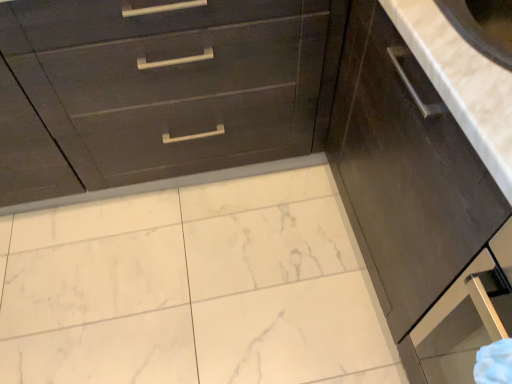
Question: Could you tell me if dark wood cabinet at right is turned towards dark wood drawer at upper left?

Choices:
 (A) yes
 (B) no

Answer: (B)

Question: Considering the relative sizes of dark wood cabinet at right and dark wood drawer at upper left in the image provided, is dark wood cabinet at right taller than dark wood drawer at upper left?

Choices:
 (A) no
 (B) yes

Answer: (A)

Question: Is dark wood cabinet at right further to the viewer compared to dark wood drawer at upper left?

Choices:
 (A) no
 (B) yes

Answer: (A)

Question: Is dark wood cabinet at right looking in the opposite direction of dark wood drawer at upper left?

Choices:
 (A) no
 (B) yes

Answer: (A)

Question: Would you say dark wood cabinet at right is a long distance from dark wood drawer at upper left?

Choices:
 (A) no
 (B) yes

Answer: (A)

Question: Is the surface of dark wood cabinet at right in direct contact with dark wood drawer at upper left?

Choices:
 (A) no
 (B) yes

Answer: (A)

Question: Can dark wood cabinet at right be found inside dark wood drawer at upper left?

Choices:
 (A) no
 (B) yes

Answer: (A)

Question: Is dark wood drawer at upper left aimed at dark wood cabinet at right?

Choices:
 (A) no
 (B) yes

Answer: (A)

Question: Is dark wood drawer at upper left not close to dark wood cabinet at right?

Choices:
 (A) no
 (B) yes

Answer: (A)

Question: Is dark wood drawer at upper left closer to camera compared to dark wood cabinet at right?

Choices:
 (A) no
 (B) yes

Answer: (A)

Question: Is dark wood drawer at upper left smaller than dark wood cabinet at right?

Choices:
 (A) no
 (B) yes

Answer: (A)

Question: Is dark wood drawer at upper left positioned beyond the bounds of dark wood cabinet at right?

Choices:
 (A) yes
 (B) no

Answer: (A)

Question: Is white marble countertop at upper right behind dark wood drawer at upper left?

Choices:
 (A) no
 (B) yes

Answer: (A)